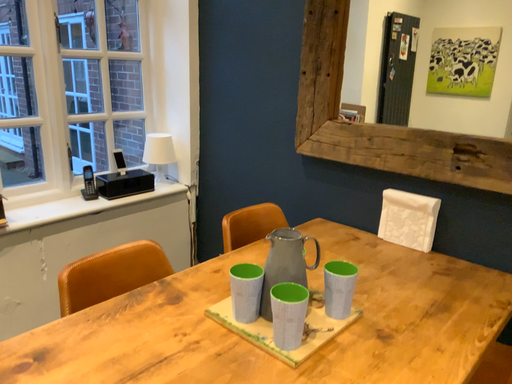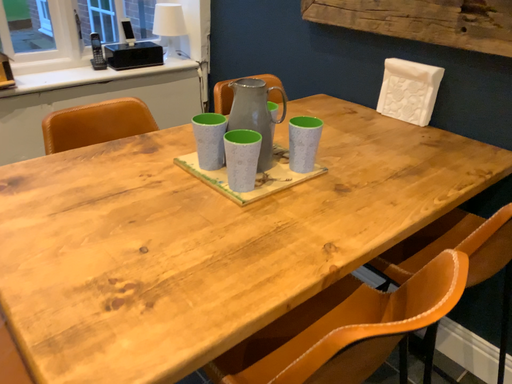
Question: How did the camera likely rotate when shooting the video?

Choices:
 (A) rotated upward
 (B) rotated downward

Answer: (B)